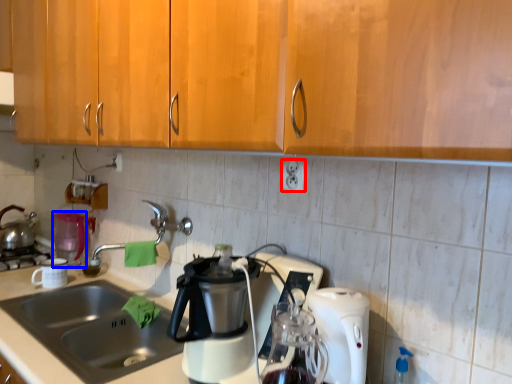
Question: Among these objects, which one is farthest to the camera, electric outlet (highlighted by a red box) or appliance (highlighted by a blue box)?

Choices:
 (A) electric outlet
 (B) appliance

Answer: (B)